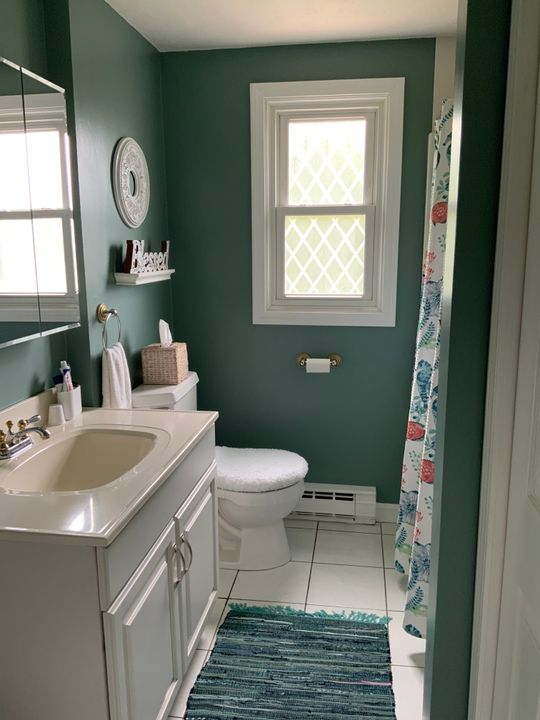
Where is `1 toilet tissue`? 1 toilet tissue is located at coordinates (317, 364).